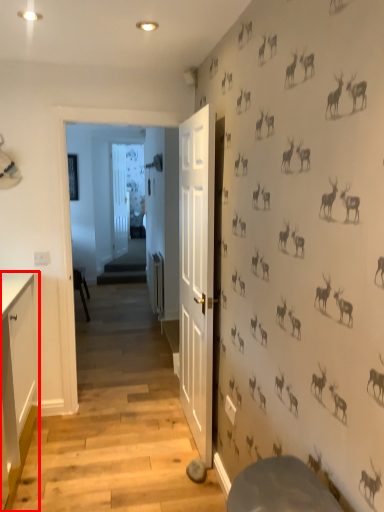
Question: From the image's perspective, what is the correct spatial positioning of cabinetry (annotated by the red box) in reference to door?

Choices:
 (A) above
 (B) below

Answer: (B)